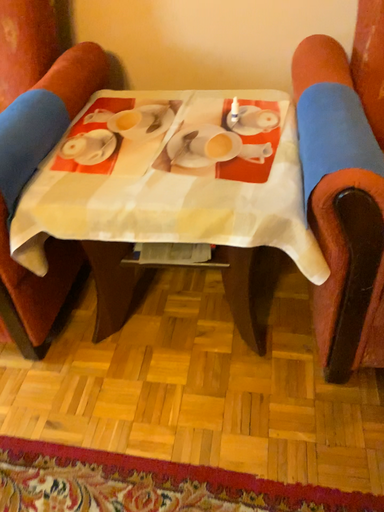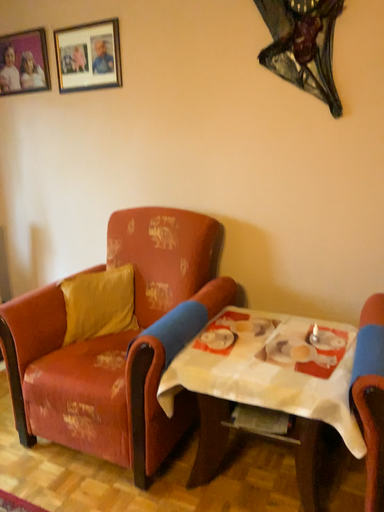
Question: Which way did the camera rotate in the video?

Choices:
 (A) rotated downward
 (B) rotated upward

Answer: (B)